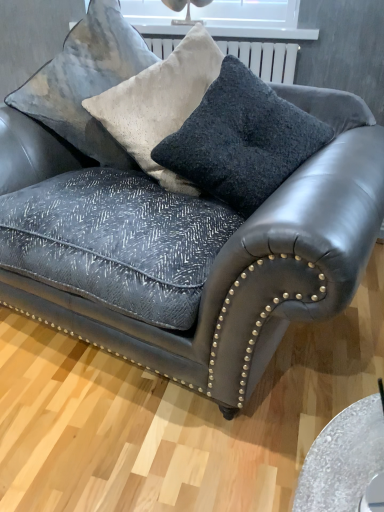
Question: Is velvet textured pillow at upper center, the first throw pillow from the left, wider or thinner than dark gray textured cushion at center, the first throw pillow in the right-to-left sequence?

Choices:
 (A) thin
 (B) wide

Answer: (B)

Question: Is velvet textured pillow at upper center, placed as the second throw pillow when sorted from right to left, in front of or behind dark gray textured cushion at center, arranged as the 2th throw pillow when viewed from the left, in the image?

Choices:
 (A) front
 (B) behind

Answer: (B)

Question: Considering the real-world distances, which object is closest to the velvet cushion at upper center?

Choices:
 (A) dark gray textured cushion at center, arranged as the 2th throw pillow when viewed from the left
 (B) velvet textured pillow at upper center, placed as the second throw pillow when sorted from right to left

Answer: (B)

Question: Estimate the real-world distances between objects in this image. Which object is farther from the dark gray textured cushion at center, the first throw pillow in the right-to-left sequence?

Choices:
 (A) velvet cushion at upper center
 (B) velvet textured pillow at upper center, placed as the second throw pillow when sorted from right to left

Answer: (A)